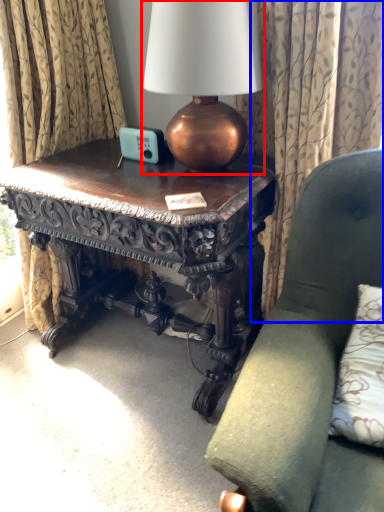
Question: Which point is further to the camera, lamp (highlighted by a red box) or curtain (highlighted by a blue box)?

Choices:
 (A) lamp
 (B) curtain

Answer: (B)